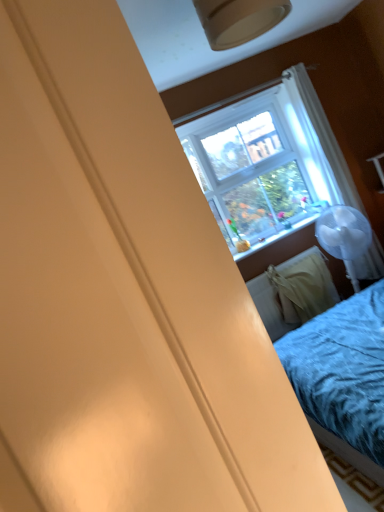
Question: Does white fabric radiator at lower right have a larger size compared to matte plastic window sill at center?

Choices:
 (A) yes
 (B) no

Answer: (A)

Question: Does white fabric radiator at lower right have a lesser width compared to matte plastic window sill at center?

Choices:
 (A) yes
 (B) no

Answer: (B)

Question: Does white fabric radiator at lower right have a lesser height compared to matte plastic window sill at center?

Choices:
 (A) no
 (B) yes

Answer: (A)

Question: From a real-world perspective, does white fabric radiator at lower right sit lower than matte plastic window sill at center?

Choices:
 (A) no
 (B) yes

Answer: (B)

Question: Is white fabric radiator at lower right in contact with matte plastic window sill at center?

Choices:
 (A) yes
 (B) no

Answer: (B)

Question: Does white fabric radiator at lower right appear on the left side of matte plastic window sill at center?

Choices:
 (A) no
 (B) yes

Answer: (A)

Question: Considering the relative positions of white sheer curtain at upper right and white fabric radiator at lower right in the image provided, is white sheer curtain at upper right behind white fabric radiator at lower right?

Choices:
 (A) yes
 (B) no

Answer: (A)

Question: Is white sheer curtain at upper right at the right side of white fabric radiator at lower right?

Choices:
 (A) yes
 (B) no

Answer: (A)

Question: Can you confirm if white sheer curtain at upper right is taller than white fabric radiator at lower right?

Choices:
 (A) yes
 (B) no

Answer: (A)

Question: Considering the relative sizes of white sheer curtain at upper right and white fabric radiator at lower right in the image provided, is white sheer curtain at upper right thinner than white fabric radiator at lower right?

Choices:
 (A) no
 (B) yes

Answer: (B)

Question: From a real-world perspective, is white sheer curtain at upper right on white fabric radiator at lower right?

Choices:
 (A) yes
 (B) no

Answer: (A)

Question: Does white sheer curtain at upper right have a larger size compared to white fabric radiator at lower right?

Choices:
 (A) yes
 (B) no

Answer: (B)

Question: Is white sheer curtain at upper right not close to matte plastic window sill at center?

Choices:
 (A) yes
 (B) no

Answer: (B)